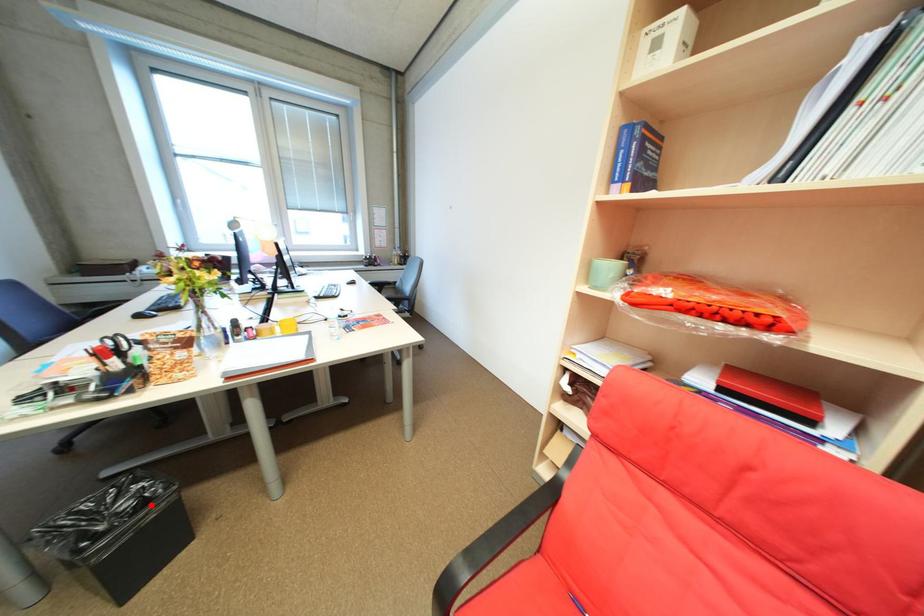
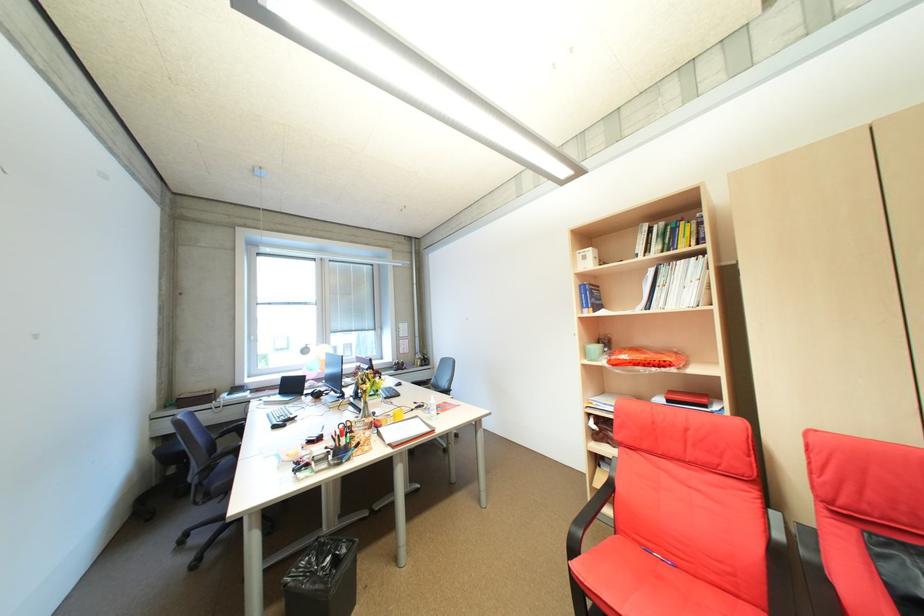
Where in the second image is the point corresponding to the highlighted location from the first image?

(345, 561)